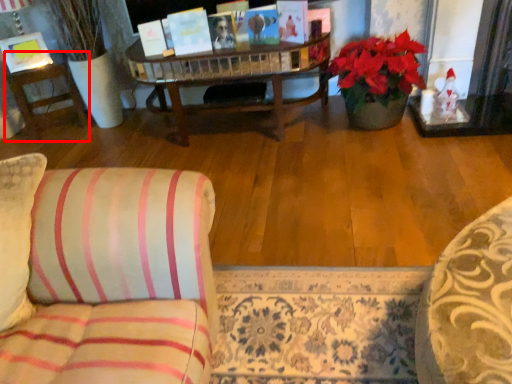
Question: From the image's perspective, considering the relative positions of side table (annotated by the red box) and picture frame in the image provided, where is side table (annotated by the red box) located with respect to the staircase?

Choices:
 (A) below
 (B) above

Answer: (A)